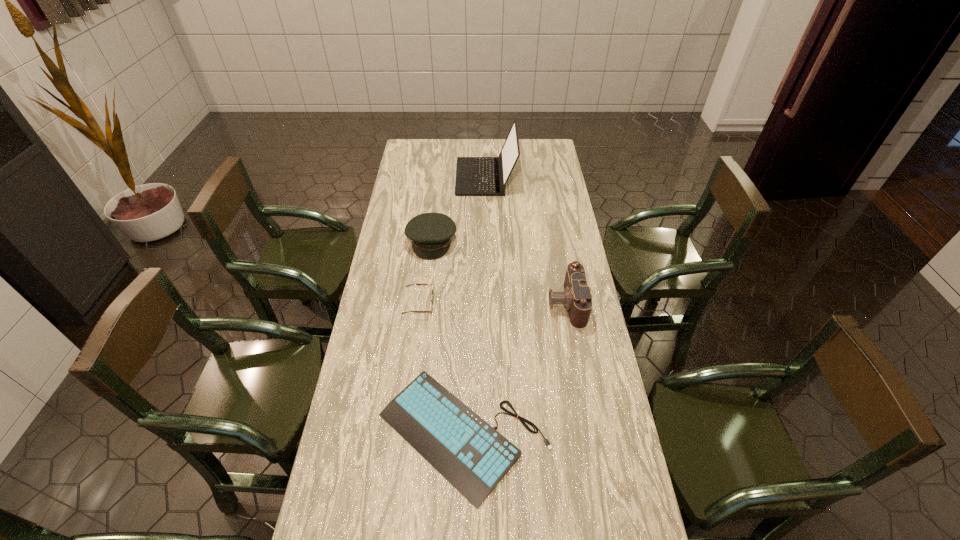
Identify the location of vacant position in the image that satisfies the following two spatial constraints: 1. on the front-facing side of the fourth nearest object; 2. on the left side of the shortest object. The height and width of the screenshot is (540, 960). (410, 434).